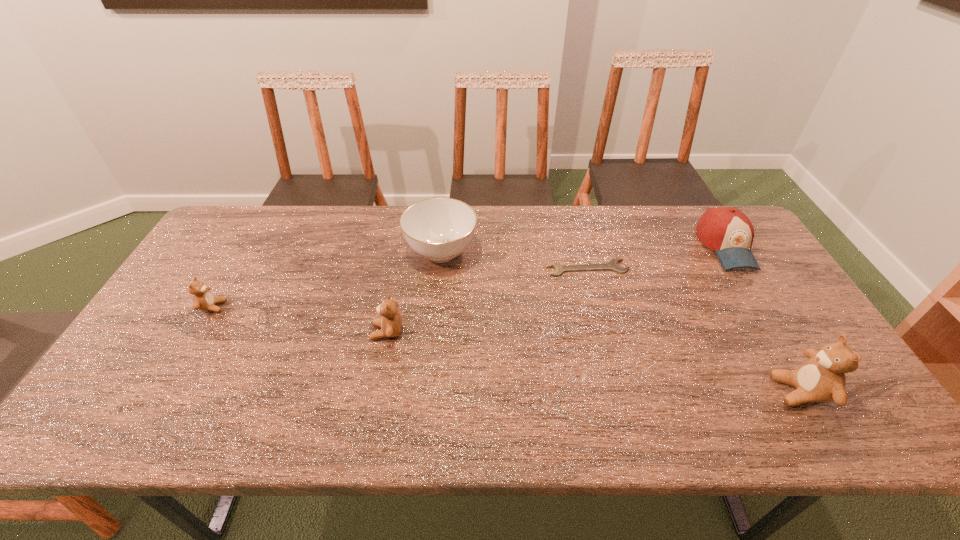
The height and width of the screenshot is (540, 960). Find the location of `baseball cap at the far edge`. baseball cap at the far edge is located at coordinates (726, 230).

You are a GUI agent. You are given a task and a screenshot of the screen. Output one action in this format:
    pyautogui.click(x=<x>, y=<y>)
    Task: Click on the object that is at the near edge
    This screenshot has height=540, width=960.
    Given the screenshot: What is the action you would take?
    pyautogui.click(x=821, y=378)

What are the coordinates of `object that is at the left edge` in the screenshot? It's located at (203, 299).

Identify the location of teddy bear present at the right edge. The width and height of the screenshot is (960, 540). (821, 378).

Image resolution: width=960 pixels, height=540 pixels. What are the coordinates of `baseball cap located at the right edge` in the screenshot? It's located at (726, 230).

The height and width of the screenshot is (540, 960). What are the coordinates of `object located in the far right corner section of the desktop` in the screenshot? It's located at (726, 230).

At what (x,y) coordinates should I click in order to perform the action: click on object at the near right corner. Please return your answer as a coordinate pair (x, y). The image size is (960, 540). Looking at the image, I should click on (821, 378).

In the image, there is a desktop. Where is `free space at the far edge`? free space at the far edge is located at coordinates (663, 221).

In the image, there is a desktop. Where is `free space at the near edge`? free space at the near edge is located at coordinates (297, 375).

Where is `vacant space at the left edge of the desktop`? Image resolution: width=960 pixels, height=540 pixels. vacant space at the left edge of the desktop is located at coordinates (193, 332).